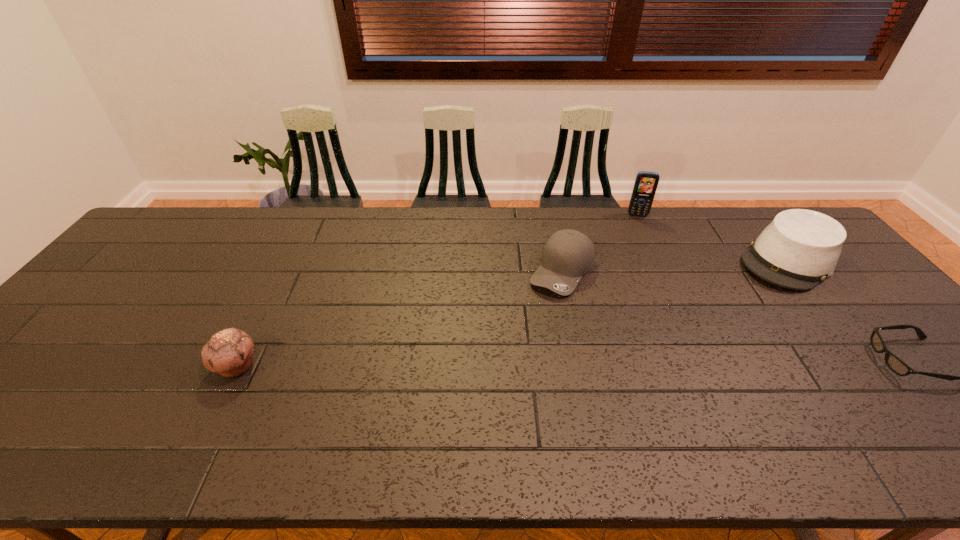
Identify which object is the fourth nearest to the second shortest object. Please provide its 2D coordinates. Your answer should be formatted as a tuple, i.e. [(x, y)], where the tuple contains the x and y coordinates of a point satisfying the conditions above.

[(895, 364)]

Identify which object is the third closest to the baseball cap. Please provide its 2D coordinates. Your answer should be formatted as a tuple, i.e. [(x, y)], where the tuple contains the x and y coordinates of a point satisfying the conditions above.

[(895, 364)]

The image size is (960, 540). I want to click on free space that satisfies the following two spatial constraints: 1. on the back side of the baseball cap; 2. on the left side of the leftmost object, so click(284, 271).